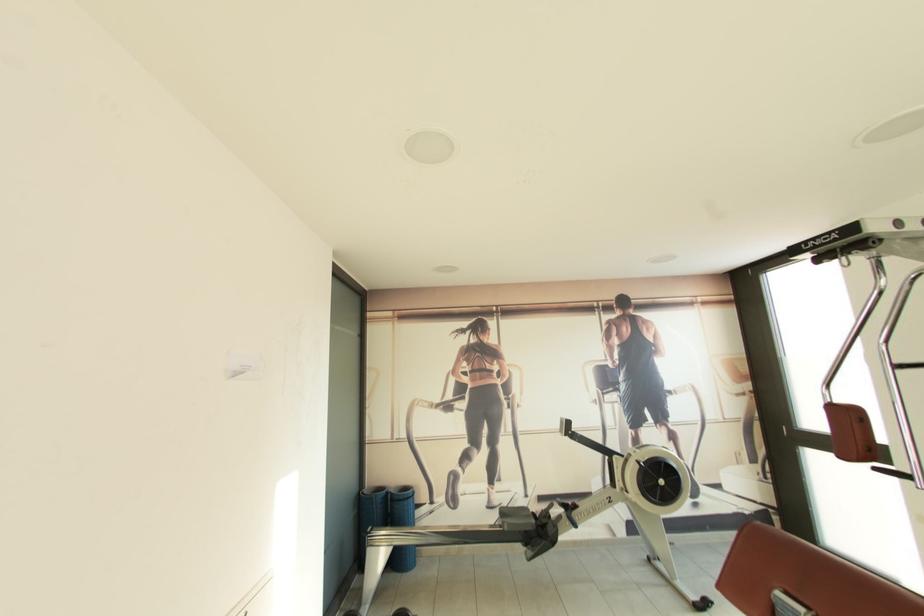
I want to click on rowing machine handle, so click(x=566, y=509).